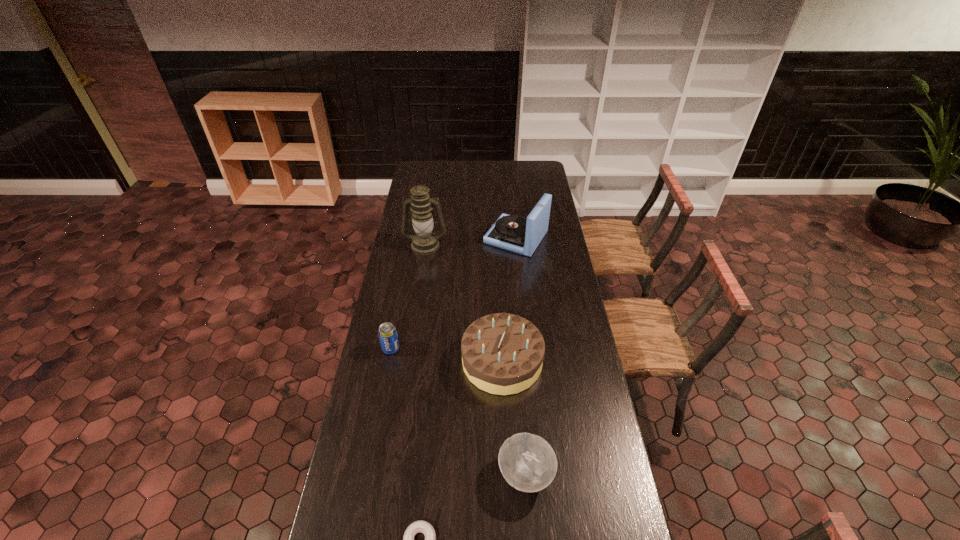
The image size is (960, 540). I want to click on the tallest object, so click(424, 242).

Identify the location of the fifth shortest object. This screenshot has height=540, width=960. (514, 233).

The width and height of the screenshot is (960, 540). Find the location of `birthday cake`. birthday cake is located at coordinates (502, 353).

Where is `soda`? The height and width of the screenshot is (540, 960). soda is located at coordinates (387, 333).

Image resolution: width=960 pixels, height=540 pixels. I want to click on the fifth farthest object, so click(528, 463).

Identify the location of bowl. (528, 463).

In order to click on free space located on the back of the tallest object in this screenshot , I will do `click(431, 210)`.

Identify the location of free spot located on the left of the fifth shortest object. The width and height of the screenshot is (960, 540). (408, 238).

Where is `free space located 0.310m on the front-facing side of the third tallest object`? free space located 0.310m on the front-facing side of the third tallest object is located at coordinates (379, 361).

I want to click on free point located on the front-facing side of the third tallest object, so click(403, 361).